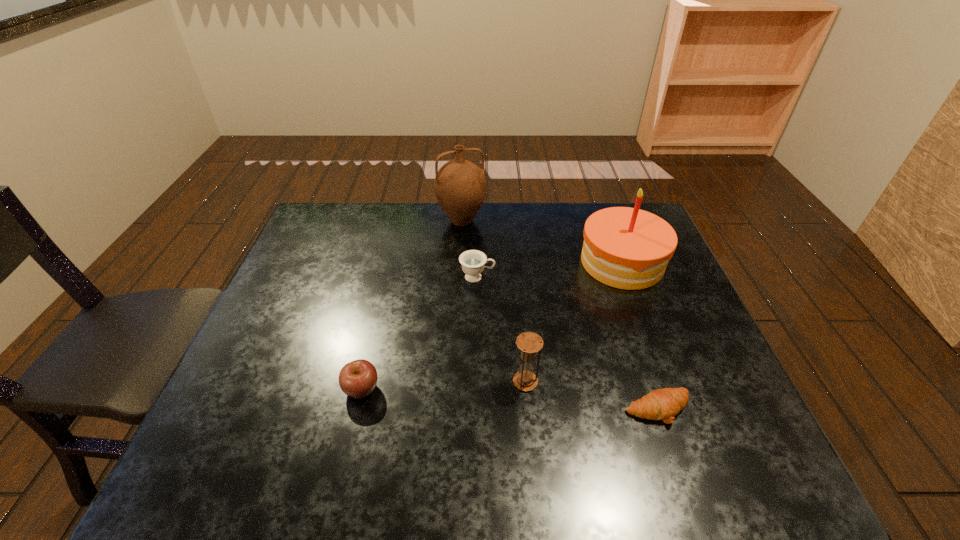
What are the coordinates of `vacant space at the left edge of the desktop` in the screenshot? It's located at (342, 250).

Where is `free point at the right edge`? The height and width of the screenshot is (540, 960). free point at the right edge is located at coordinates (688, 424).

The width and height of the screenshot is (960, 540). In the image, there is a desktop. What are the coordinates of `free space at the near right corner` in the screenshot? It's located at (719, 451).

Find the location of `vacant point located between the teacup and the birthday cake`. vacant point located between the teacup and the birthday cake is located at coordinates (550, 270).

Find the location of a particular element. empty space between the leftmost object and the hourglass is located at coordinates (444, 385).

Locate an element on the screen. The image size is (960, 540). blank region between the birthday cake and the hourglass is located at coordinates (574, 322).

Identify the location of free space between the leftmost object and the farthest object. This screenshot has width=960, height=540. (412, 305).

Where is `free spot between the pitcher and the birthday cake`? This screenshot has height=540, width=960. free spot between the pitcher and the birthday cake is located at coordinates (541, 241).

This screenshot has height=540, width=960. Identify the location of free area in between the fourth shortest object and the teacup. (501, 329).

Where is `vacant space in between the pitcher and the apple`? vacant space in between the pitcher and the apple is located at coordinates (412, 305).